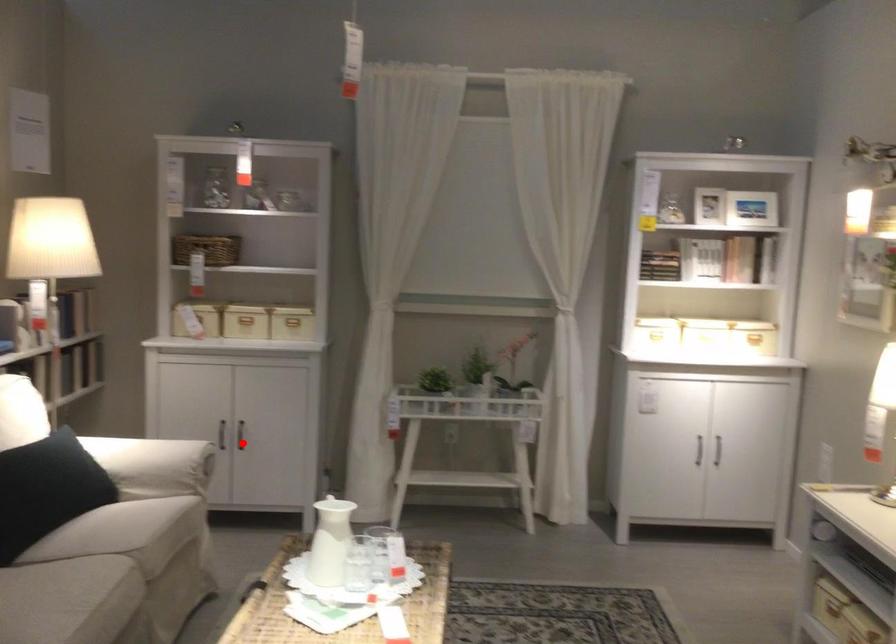
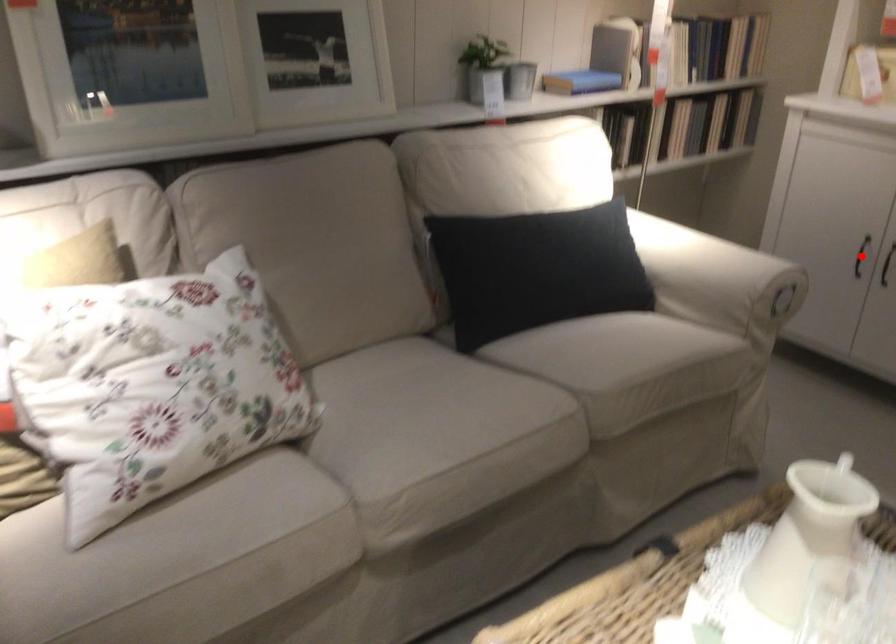
I am providing you with two images of the same scene from different viewpoints. A red point is marked on the first image and another point is marked on the second image. Is the red point in image1 aligned with the point shown in image2?

No